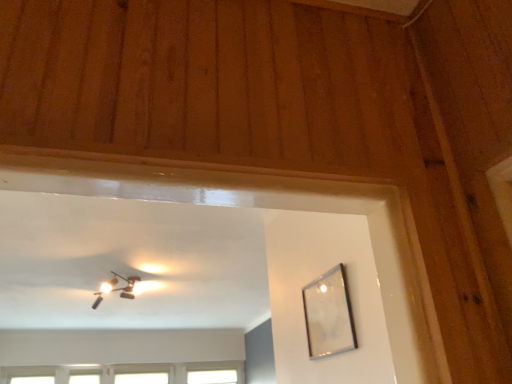
Question: Is clear glass picture frame at upper right further to camera compared to matte black fixture at upper center?

Choices:
 (A) no
 (B) yes

Answer: (A)

Question: Is clear glass picture frame at upper right facing away from matte black fixture at upper center?

Choices:
 (A) yes
 (B) no

Answer: (B)

Question: Considering the relative sizes of clear glass picture frame at upper right and matte black fixture at upper center in the image provided, is clear glass picture frame at upper right wider than matte black fixture at upper center?

Choices:
 (A) yes
 (B) no

Answer: (B)

Question: Is clear glass picture frame at upper right aimed at matte black fixture at upper center?

Choices:
 (A) no
 (B) yes

Answer: (A)

Question: Considering the relative positions of clear glass picture frame at upper right and matte black fixture at upper center in the image provided, is clear glass picture frame at upper right to the left of matte black fixture at upper center from the viewer's perspective?

Choices:
 (A) no
 (B) yes

Answer: (A)

Question: Is clear glass picture frame at upper right in front of or behind clear glass window at lower center, the second window from the right, in the image?

Choices:
 (A) front
 (B) behind

Answer: (A)

Question: From a real-world perspective, is clear glass picture frame at upper right physically located above or below clear glass window at lower center, the second window from the right?

Choices:
 (A) below
 (B) above

Answer: (A)

Question: Considering the positions of clear glass picture frame at upper right and clear glass window at lower center, acting as the 3th window starting from the left, in the image, is clear glass picture frame at upper right taller or shorter than clear glass window at lower center, acting as the 3th window starting from the left,?

Choices:
 (A) short
 (B) tall

Answer: (B)

Question: Looking at their shapes, would you say clear glass picture frame at upper right is wider or thinner than clear glass window at lower center, the second window from the right?

Choices:
 (A) wide
 (B) thin

Answer: (B)

Question: From the image's perspective, is transparent glass window at lower left, the 2th window when ordered from left to right, positioned above or below matte black fixture at upper center?

Choices:
 (A) below
 (B) above

Answer: (A)

Question: Do you think transparent glass window at lower left, the 3th window when ordered from right to left, is within matte black fixture at upper center, or outside of it?

Choices:
 (A) inside
 (B) outside

Answer: (B)

Question: Considering their positions, is transparent glass window at lower left, the 3th window when ordered from right to left, located in front of or behind matte black fixture at upper center?

Choices:
 (A) behind
 (B) front

Answer: (A)

Question: Considering the positions of point (89, 372) and point (96, 297), is point (89, 372) closer or farther from the camera than point (96, 297)?

Choices:
 (A) closer
 (B) farther

Answer: (B)

Question: Considering the positions of clear glass window at lower center, the second window from the right, and clear glass picture frame at upper right in the image, is clear glass window at lower center, the second window from the right, wider or thinner than clear glass picture frame at upper right?

Choices:
 (A) thin
 (B) wide

Answer: (B)

Question: In terms of height, does clear glass window at lower center, the second window from the right, look taller or shorter compared to clear glass picture frame at upper right?

Choices:
 (A) tall
 (B) short

Answer: (B)